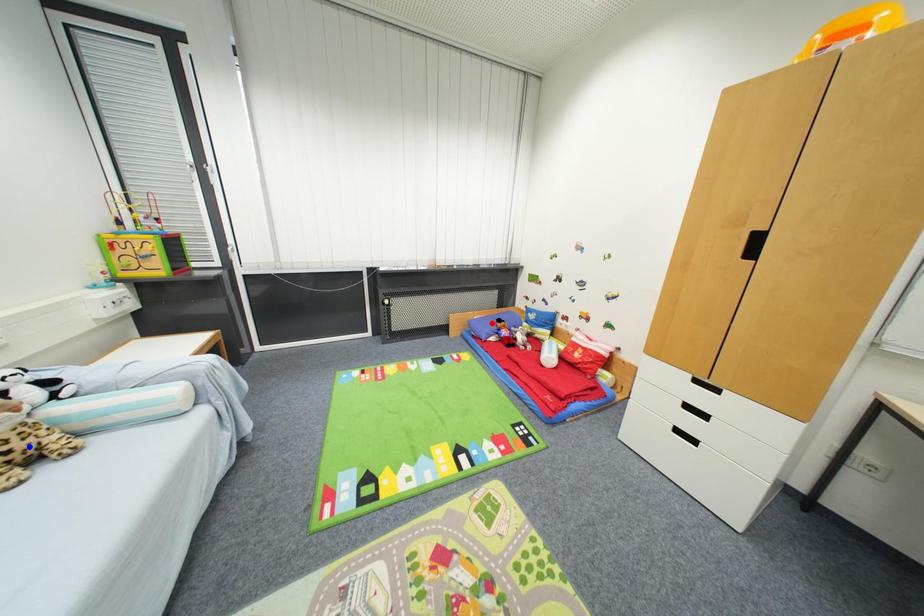
Question: In the image, two points are highlighted. Which point is nearer to the camera? Reply with the corresponding letter.

Choices:
 (A) blue point
 (B) red point

Answer: (A)